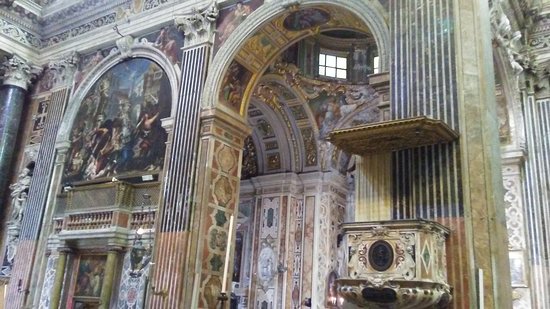
You are a GUI agent. You are given a task and a screenshot of the screen. Output one action in this format:
    pyautogui.click(x=<x>, y=<y>)
    Task: Click on the painting
    This screenshot has width=550, height=309.
    Given the screenshot: What is the action you would take?
    click(121, 117)